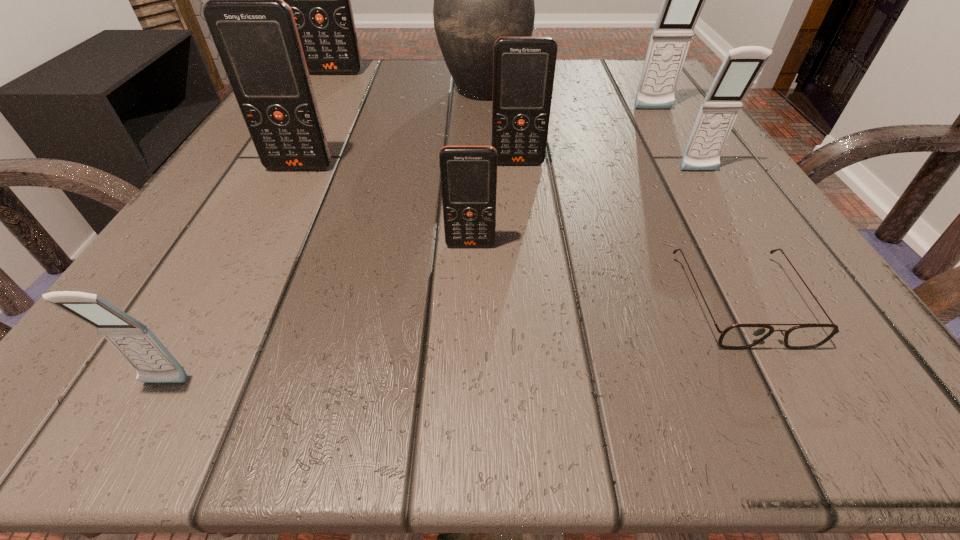
Identify the location of vacant space at the near edge. pyautogui.click(x=704, y=350).

Where is `free location at the left edge of the desktop`? The image size is (960, 540). free location at the left edge of the desktop is located at coordinates (255, 220).

The width and height of the screenshot is (960, 540). I want to click on vacant space at the right edge of the desktop, so click(x=678, y=273).

Find the location of `free region at the far left corner`. free region at the far left corner is located at coordinates (339, 93).

What are the coordinates of `free space at the far right corner of the desktop` in the screenshot? It's located at (626, 76).

Find the location of a particular element. Image resolution: width=960 pixels, height=540 pixels. free space at the near right corner is located at coordinates (756, 398).

Identify the location of vacant area that lies between the shortest object and the third smallest orange cellular telephone. (520, 234).

Where is `free spot between the third nearest object and the tallest cellular telephone`? Image resolution: width=960 pixels, height=540 pixels. free spot between the third nearest object and the tallest cellular telephone is located at coordinates (402, 159).

This screenshot has height=540, width=960. I want to click on free space between the biggest orange cellular telephone and the pitcher, so click(x=409, y=80).

I want to click on vacant space that is in between the farthest cellular telephone and the pitcher, so click(x=409, y=80).